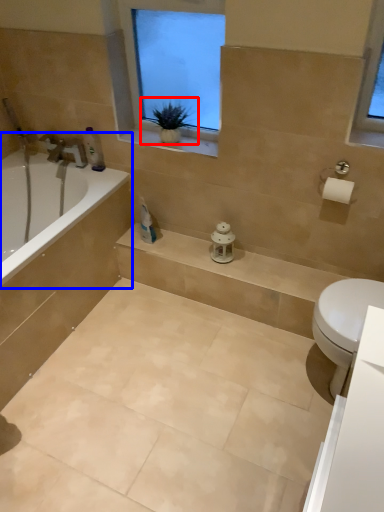
Question: Which point is closer to the camera, houseplant (highlighted by a red box) or bathtub (highlighted by a blue box)?

Choices:
 (A) houseplant
 (B) bathtub

Answer: (A)